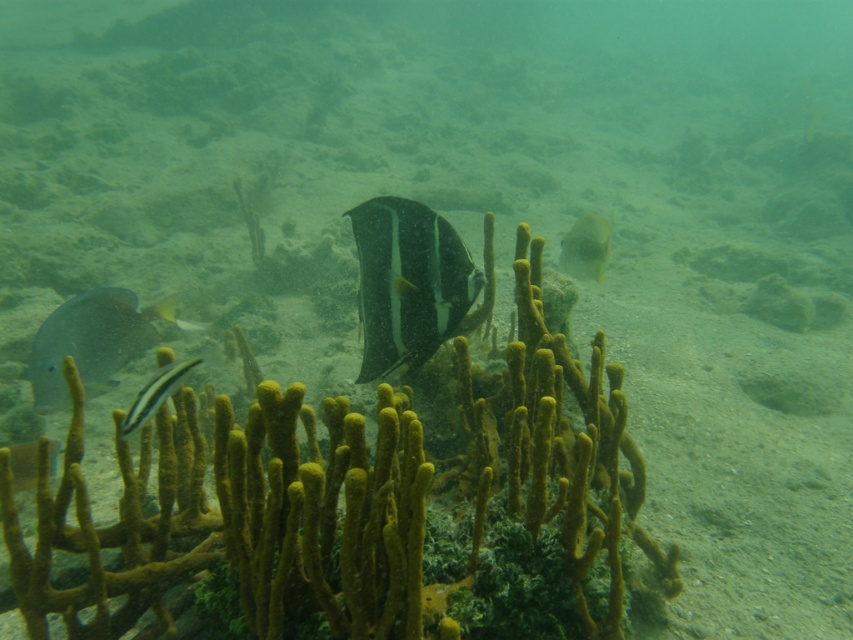
You are a scuba diver with a 2.5 meter long snorkel. You see the yellow matte fish at center. Can you reach it with your snorkel without moving closer?

The yellow matte fish at center is 3.25 meters away from the viewer. Since the snorkel is only 2.5 meters long, it is not long enough to reach the fish without moving closer.